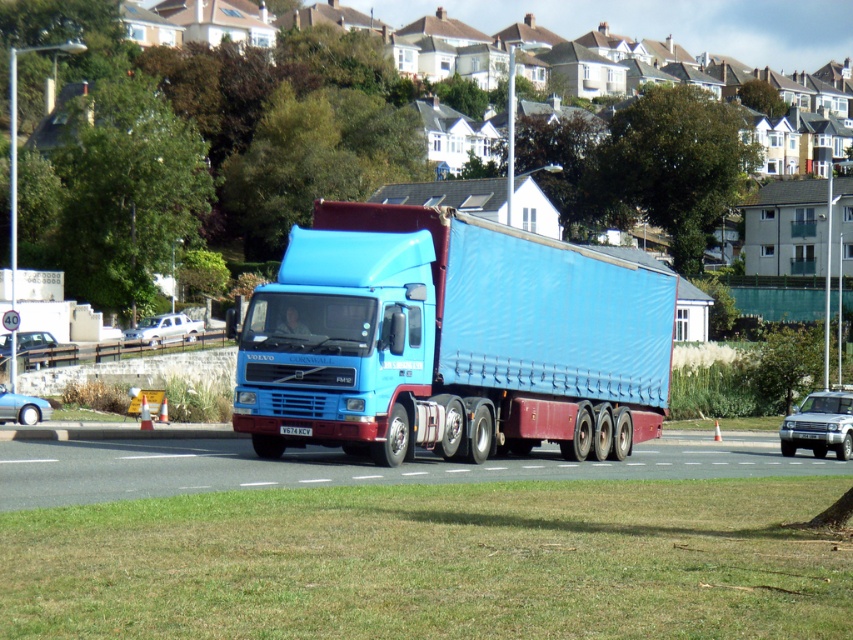
Can you confirm if silver metallic suv at center is positioned to the left of metallic blue sedan at lower left?

In fact, silver metallic suv at center is to the right of metallic blue sedan at lower left.

Is silver metallic suv at center wider than metallic blue sedan at lower left?

Yes.

Who is more distant from viewer, (811,438) or (28,397)?

Point (811,438)

Find the location of a particular element. This screenshot has width=853, height=640. silver metallic suv at center is located at coordinates (819, 426).

Between point (30, 336) and point (190, 324), which one is positioned in front?

Positioned in front is point (30, 336).

The width and height of the screenshot is (853, 640). What are the coordinates of `metallic silver car at center` in the screenshot? It's located at (42, 349).

Can you confirm if metallic silver car at center is thinner than metallic blue sedan at lower left?

No, metallic silver car at center is not thinner than metallic blue sedan at lower left.

Is point (22, 356) more distant than point (30, 404)?

Yes.

I want to click on metallic silver car at center, so click(42, 349).